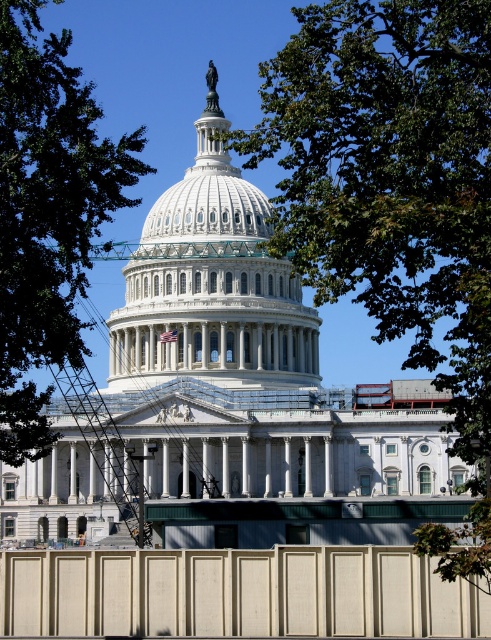
Locate an element on the screen. The width and height of the screenshot is (491, 640). green leafy tree at upper center is located at coordinates (394, 198).